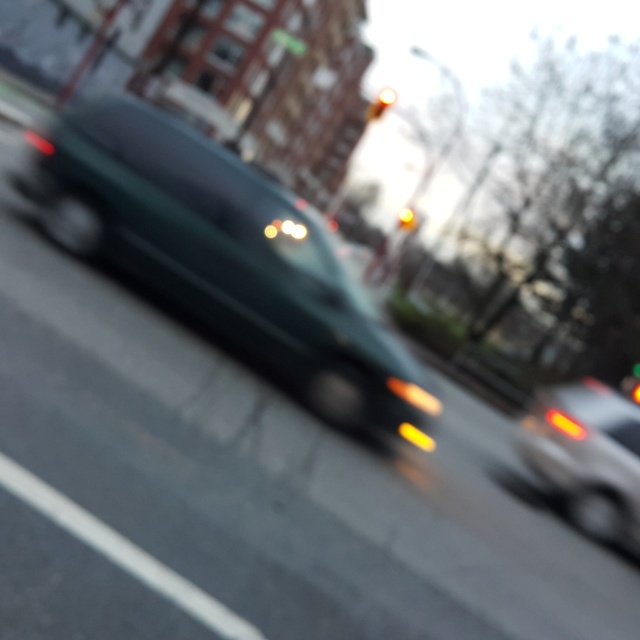
You are a driver approaching an intersection. You see the dark green matte van at center and the yellow glass traffic light at upper center. Which object is closer to the left side of the intersection?

The dark green matte van at center is positioned on the left side of yellow glass traffic light at upper center, so it is closer to the left side of the intersection.

In the scene shown: You are a passenger in a car and notice the matte silver car at right and the yellow glass traffic light at center. From your perspective inside the vehicle, which object is positioned lower in the scene?

The matte silver car at right is positioned below the yellow glass traffic light at center, so it is lower in the scene.

You are driving a car and want to maintain a safe distance of at least 10 meters from the dark green matte van at center. Can you safely reduce your speed to keep this distance?

The dark green matte van at center is currently 9.66 meters away from the camera, which is less than the required 10 meters. To maintain a safe distance, you should not reduce speed but instead increase it to create more space between your car and the van.